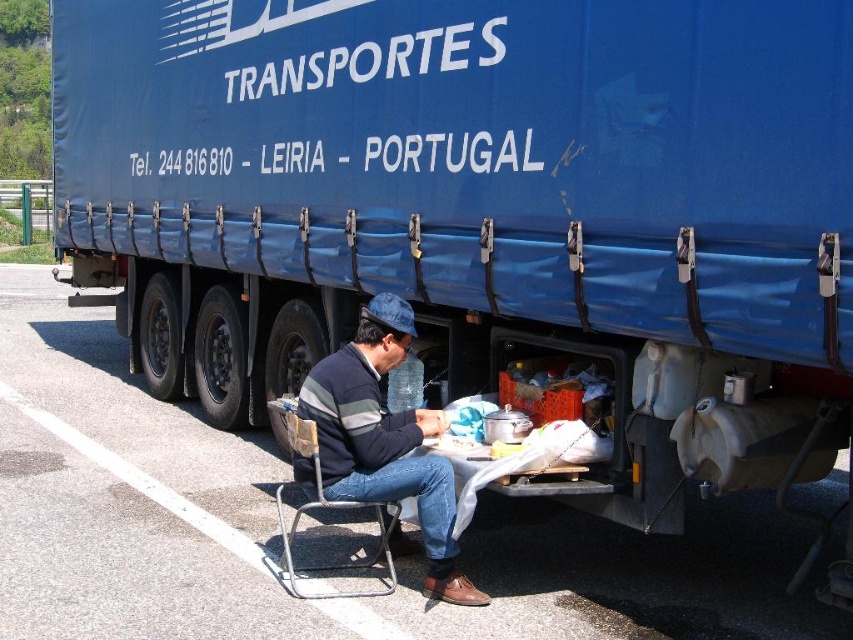
You are standing at the point marked as the asphalt road at lower left. Which direction should you walk to reach the large blue truck parked on the side of the road?

The asphalt road at lower left is located at point (277, 531). Since the truck is parked on the side of the road, you should walk towards the truck along the road from the asphalt road at lower left.

In the scene shown: You are standing in front of the large blue truck parked on the side of the road in Leiria, Portugal. You notice two points marked on the truck. The first point is at coordinates point (439, 588) and the second point is at point (315, 506). Which of these two points is closer to you?

Point (315, 506) is closer to you because it is less further to the camera than point (439, 588).